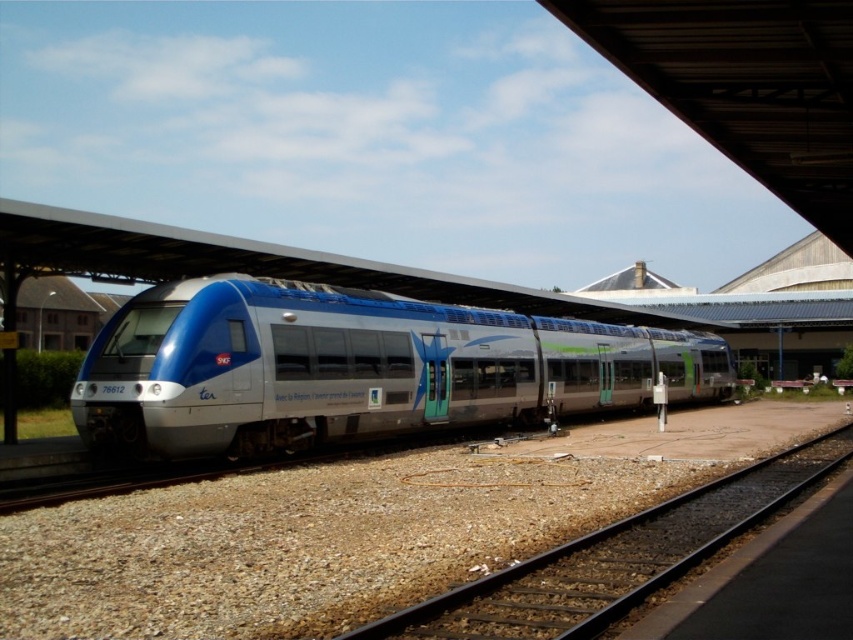
You are standing on the platform at the station. You see the matte metallic train at center. Where is the train located relative to the platform?

The matte metallic train at center is located at the center of the platform, as its 2D coordinates are at point (352, 368), which is near the middle of the platform.

You are standing at the platform of the train station. You see the point at coordinate (352, 368). What object is located at that point?

The point at coordinate (352, 368) is occupied by the matte metallic train at center.